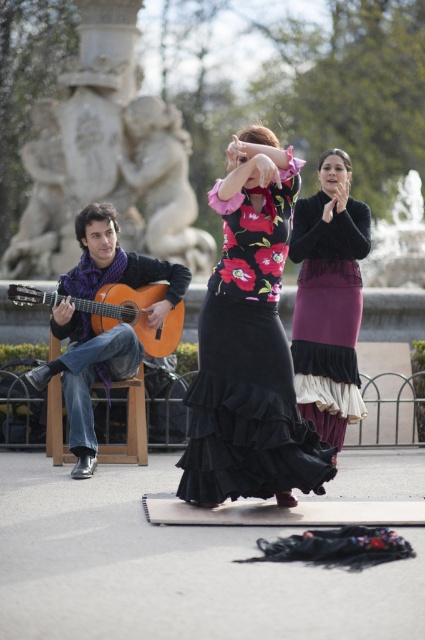
Question: Does black satin dress at center have a smaller size compared to orange wood guitar at left?

Choices:
 (A) yes
 (B) no

Answer: (B)

Question: Which is nearer to the orange wood guitar at left?

Choices:
 (A) matte orange guitar at left
 (B) black satin dress at center

Answer: (A)

Question: Can you confirm if black satin dress at center is positioned above orange wood guitar at left?

Choices:
 (A) yes
 (B) no

Answer: (B)

Question: Is matte orange guitar at left to the right of orange wood guitar at left from the viewer's perspective?

Choices:
 (A) no
 (B) yes

Answer: (A)

Question: Which object appears closest to the camera in this image?

Choices:
 (A) orange wood guitar at left
 (B) black satin dress at center
 (C) velvet purple skirt at center

Answer: (B)

Question: Among these objects, which one is nearest to the camera?

Choices:
 (A) black satin dress at center
 (B) orange wood guitar at left

Answer: (A)